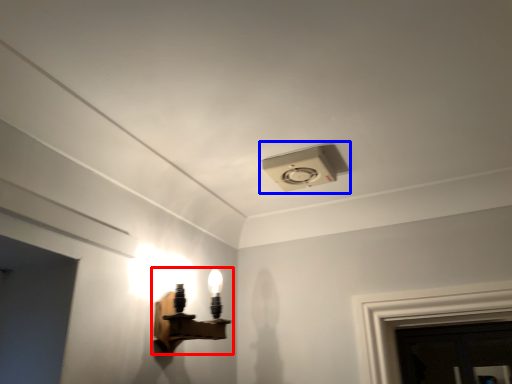
Question: Which object appears farthest to the camera in this image, lamp (highlighted by a red box) or lamp (highlighted by a blue box)?

Choices:
 (A) lamp
 (B) lamp

Answer: (B)